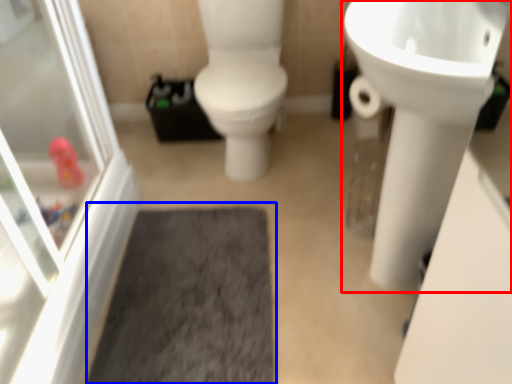
Question: Which object appears closest to the camera in this image, sink (highlighted by a red box) or bath mat (highlighted by a blue box)?

Choices:
 (A) sink
 (B) bath mat

Answer: (A)